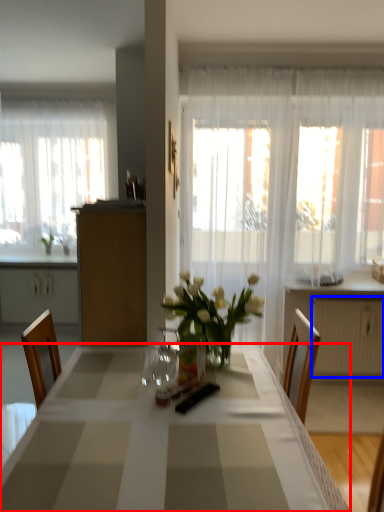
Question: Which object is further to the camera taking this photo, desk (highlighted by a red box) or radiator (highlighted by a blue box)?

Choices:
 (A) desk
 (B) radiator

Answer: (B)